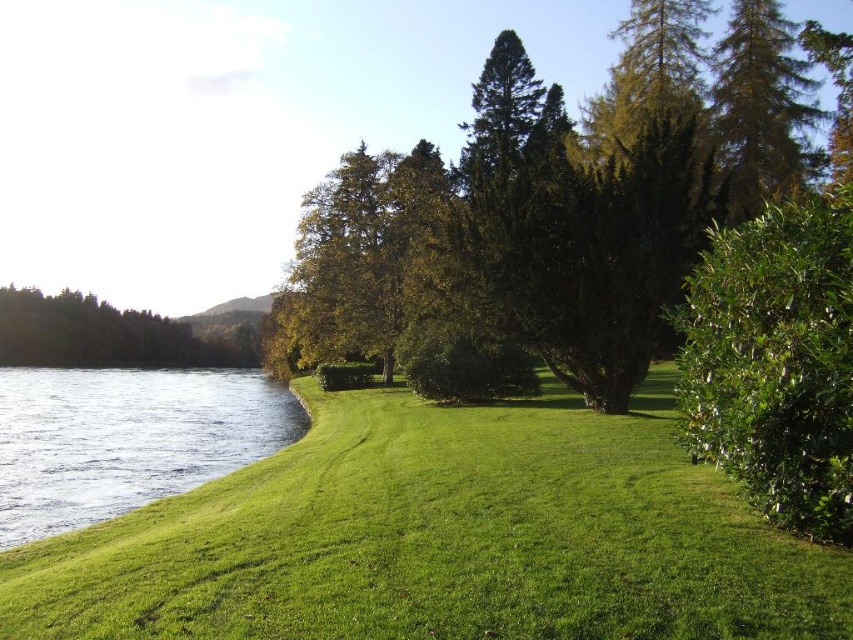
You are standing in the middle of the grassy area and want to walk towards the water. Which direction should you go to avoid the green leafy tree at center and the green leafy tree at left?

To avoid both the green leafy tree at center and the green leafy tree at left, you should walk towards the right side since the green leafy tree at center is positioned on the right side of the green leafy tree at left. This means the tree at left is further to the left, so moving right would take you away from both trees toward the water.